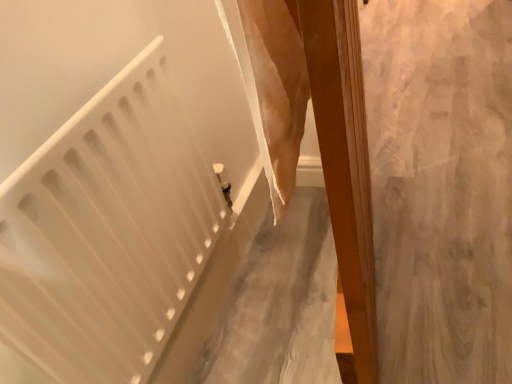
Measure the distance between point (x=151, y=313) and camera.

Point (x=151, y=313) is 33.54 inches from camera.

Describe the element at coordinates (108, 231) in the screenshot. This screenshot has height=384, width=512. I see `white matte radiator at left` at that location.

Where is `white matte radiator at left`? white matte radiator at left is located at coordinates (108, 231).

Where is `white matte radiator at left`? Image resolution: width=512 pixels, height=384 pixels. white matte radiator at left is located at coordinates (108, 231).